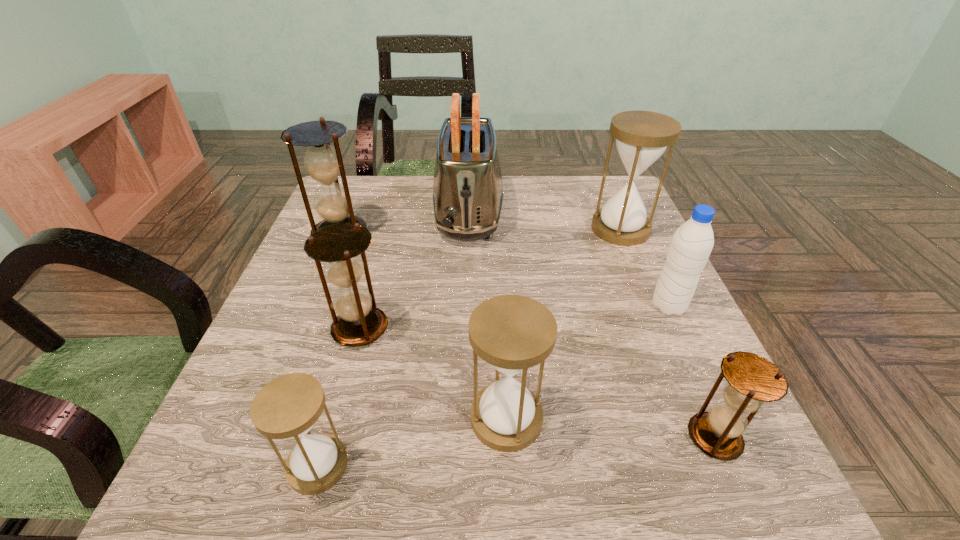
Where is `free location at the far left corner of the desktop`? free location at the far left corner of the desktop is located at coordinates (x=389, y=185).

This screenshot has height=540, width=960. In the image, there is a desktop. In order to click on free space at the far right corner in this screenshot , I will do (592, 185).

This screenshot has height=540, width=960. Identify the location of vacant position at the near right corner of the desktop. (729, 506).

Find the location of `unoccupied position between the second nearest brown hourglass and the toaster`. unoccupied position between the second nearest brown hourglass and the toaster is located at coordinates (415, 271).

Locate an element on the screen. The height and width of the screenshot is (540, 960). vacant space that is in between the gray toaster and the leftmost white hourglass is located at coordinates (393, 339).

Locate an element on the screen. vacant point located between the gray water bottle and the toaster is located at coordinates (568, 260).

I want to click on free space between the leftmost white hourglass and the nearest brown hourglass, so click(516, 451).

The image size is (960, 540). Find the location of `free area in between the gray toaster and the rightmost brown hourglass`. free area in between the gray toaster and the rightmost brown hourglass is located at coordinates (591, 326).

The image size is (960, 540). I want to click on free spot between the smallest brown hourglass and the second biggest white hourglass, so [x=611, y=428].

This screenshot has height=540, width=960. In order to click on object that stands as the third closest to the smallest brown hourglass in this screenshot , I will do (x=642, y=137).